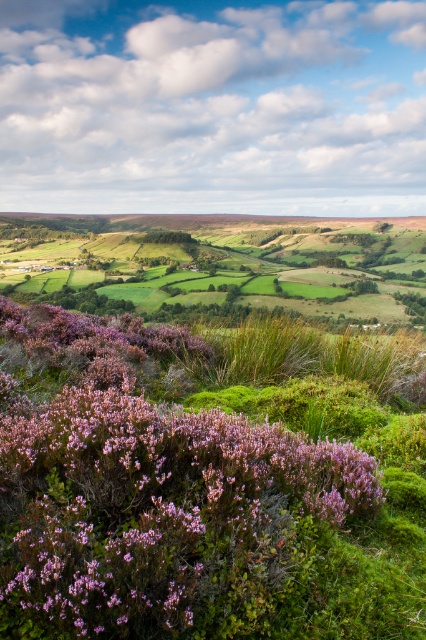
You are a photographer standing at the edge of the purple matte flowers at lower left, wanting to capture a shot of the green grassy field at center. Since you want the flowers to appear in the foreground, will the current arrangement allow you to do this?

The purple matte flowers at lower left are in front of the green grassy field at center, so yes, the current arrangement allows the flowers to appear in the foreground of the shot.

You are a gardener who wants to plant a new flower bed. You notice the purple matte flowers at lower left and the green grassy field at center. Which area would be better for planting flowers that require less height?

The purple matte flowers at lower left is shorter than the green grassy field at center, so the purple matte flowers at lower left area would be better for planting flowers that require less height.